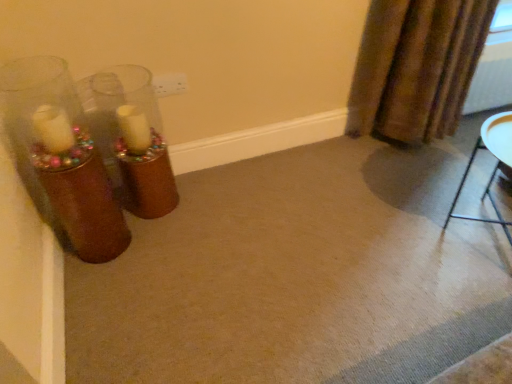
Question: Can you confirm if brown textured curtain at upper right is positioned to the right of metallic silver tray at lower right?

Choices:
 (A) no
 (B) yes

Answer: (A)

Question: Considering the relative positions of brown textured curtain at upper right and metallic silver tray at lower right in the image provided, is brown textured curtain at upper right to the left of metallic silver tray at lower right from the viewer's perspective?

Choices:
 (A) yes
 (B) no

Answer: (A)

Question: Is brown textured curtain at upper right directly adjacent to metallic silver tray at lower right?

Choices:
 (A) yes
 (B) no

Answer: (B)

Question: From the image's perspective, is brown textured curtain at upper right located above metallic silver tray at lower right?

Choices:
 (A) no
 (B) yes

Answer: (B)

Question: Can you confirm if brown textured curtain at upper right is smaller than metallic silver tray at lower right?

Choices:
 (A) yes
 (B) no

Answer: (B)

Question: Does brown textured curtain at upper right come behind metallic silver tray at lower right?

Choices:
 (A) no
 (B) yes

Answer: (B)

Question: Does metallic silver tray at lower right touch brown textured curtain at upper right?

Choices:
 (A) yes
 (B) no

Answer: (B)

Question: Does metallic silver tray at lower right have a larger size compared to brown textured curtain at upper right?

Choices:
 (A) no
 (B) yes

Answer: (A)

Question: Is metallic silver tray at lower right shorter than brown textured curtain at upper right?

Choices:
 (A) yes
 (B) no

Answer: (A)

Question: Considering the relative positions of metallic silver tray at lower right and brown textured curtain at upper right in the image provided, is metallic silver tray at lower right to the right of brown textured curtain at upper right from the viewer's perspective?

Choices:
 (A) no
 (B) yes

Answer: (B)

Question: Is metallic silver tray at lower right looking in the opposite direction of brown textured curtain at upper right?

Choices:
 (A) no
 (B) yes

Answer: (A)

Question: From a real-world perspective, is metallic silver tray at lower right on top of brown textured curtain at upper right?

Choices:
 (A) yes
 (B) no

Answer: (B)

Question: Looking at the image, does metallic silver tray at lower right seem bigger or smaller compared to brown textured curtain at upper right?

Choices:
 (A) big
 (B) small

Answer: (B)